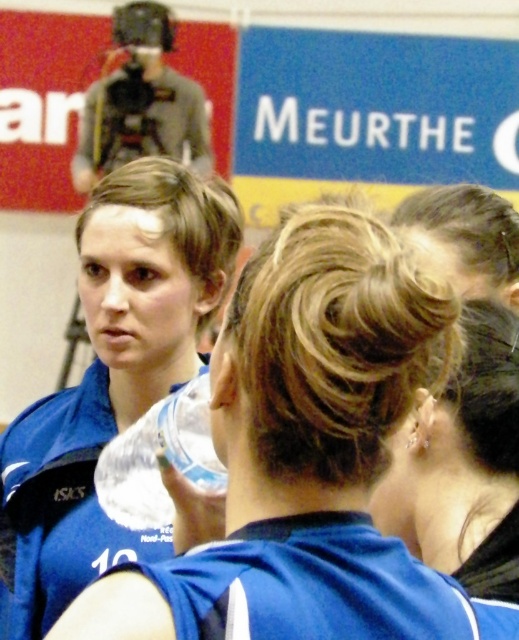
Question: Observing the image, what is the correct spatial positioning of satin blue hair bun at center in reference to clear plastic bottle at center?

Choices:
 (A) left
 (B) right

Answer: (B)

Question: Which point appears closest to the camera in this image?

Choices:
 (A) (75, 476)
 (B) (488, 556)
 (C) (491, 400)

Answer: (B)

Question: Which object is closer to the camera taking this photo?

Choices:
 (A) clear plastic bottle at center
 (B) blue fabric uniform at center
 (C) blue jersey at center
 (D) satin blue hair bun at center

Answer: (C)

Question: Is satin blue hair bun at center to the left of clear plastic bottle at center from the viewer's perspective?

Choices:
 (A) yes
 (B) no

Answer: (B)

Question: Estimate the real-world distances between objects in this image. Which object is closer to the satin blue hair bun at center?

Choices:
 (A) blue jersey at center
 (B) blue fabric uniform at center
 (C) clear plastic bottle at center

Answer: (A)

Question: Can you confirm if blue jersey at center is smaller than clear plastic bottle at center?

Choices:
 (A) yes
 (B) no

Answer: (A)